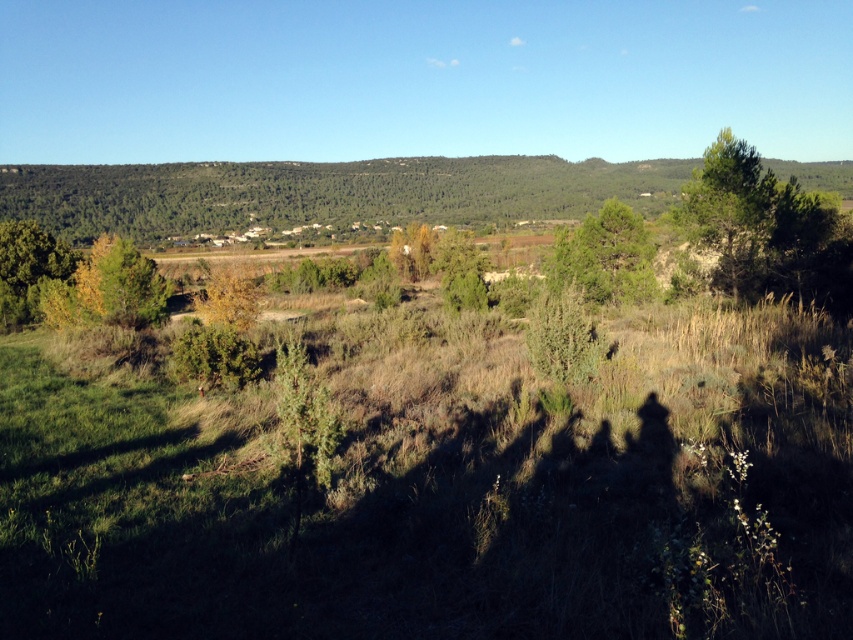
Question: Which of these objects is positioned closest to the green leafy bush at center?

Choices:
 (A) green leafy tree at left
 (B) green textured tree at center
 (C) yellow-green leafy tree at center-left

Answer: (B)

Question: Considering the real-world distances, which object is closest to the yellow-green leafy tree at center-left?

Choices:
 (A) green leafy tree at left
 (B) green leafy bush at center

Answer: (A)

Question: Is green leafy bush at center above green leafy tree at left?

Choices:
 (A) no
 (B) yes

Answer: (A)

Question: Is green leafy bush at center smaller than green leafy tree at left?

Choices:
 (A) yes
 (B) no

Answer: (A)

Question: Does yellow-green leafy tree at center-left come in front of green leafy bush at center?

Choices:
 (A) no
 (B) yes

Answer: (A)

Question: Which object is the farthest from the green leafy tree at left?

Choices:
 (A) yellow-green leafy tree at center-left
 (B) green leafy bush at center

Answer: (B)